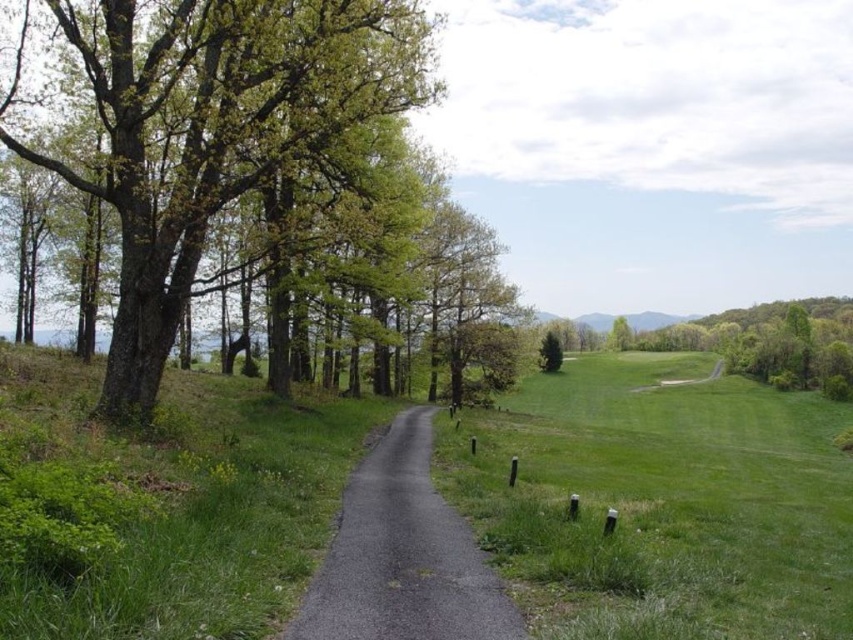
You are a hiker carrying a 1.5 meter wide backpack. You want to walk along the asphalt road at center while keeping the green matte tree at center on your left side. Is there enough space between the road and the tree for your backpack?

The distance between the asphalt road at center and the green matte tree at center is 88.74 meters, which is more than enough space for a backpack that is 1.5 meters wide. You can comfortably walk along the road while keeping the tree on your left side.

You are a hiker walking along the paved path in the rural landscape. You notice two trees ahead of you, the green leafy tree at left and the green matte tree at center. Which tree would cast a larger shadow on the path?

The green leafy tree at left is larger in size than the green matte tree at center, so it would cast a larger shadow on the path.